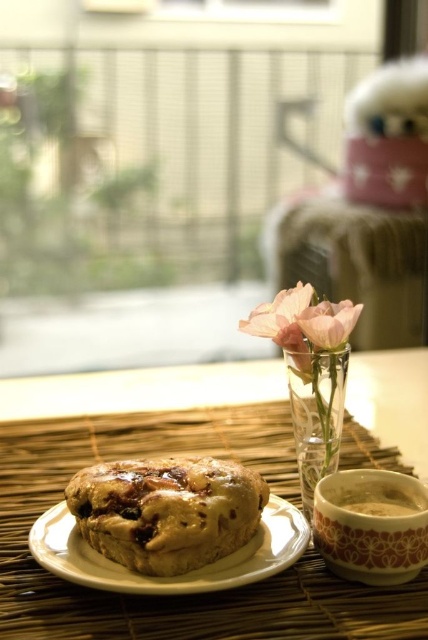
Question: Estimate the real-world distances between objects in this image. Which object is closer to the pink glass vase at center?

Choices:
 (A) pink matte glass vase at center
 (B) matte brown plate at center
 (C) golden-brown crumbly muffin at center
 (D) brown ceramic mug at lower right

Answer: (A)

Question: Which of the following is the farthest from the observer?

Choices:
 (A) (276, 300)
 (B) (392, 515)

Answer: (A)

Question: Can you confirm if clear glass vase at center is positioned above pink glass vase at center?

Choices:
 (A) no
 (B) yes

Answer: (A)

Question: Which point is farther from the camera taking this photo?

Choices:
 (A) (391, 506)
 (B) (177, 394)
 (C) (344, 332)
 (D) (73, 554)

Answer: (B)

Question: Observing the image, what is the correct spatial positioning of matte brown plate at center in reference to brown ceramic mug at lower right?

Choices:
 (A) right
 (B) left

Answer: (B)

Question: Is white ceramic plate at center below pink matte glass vase at center?

Choices:
 (A) yes
 (B) no

Answer: (A)